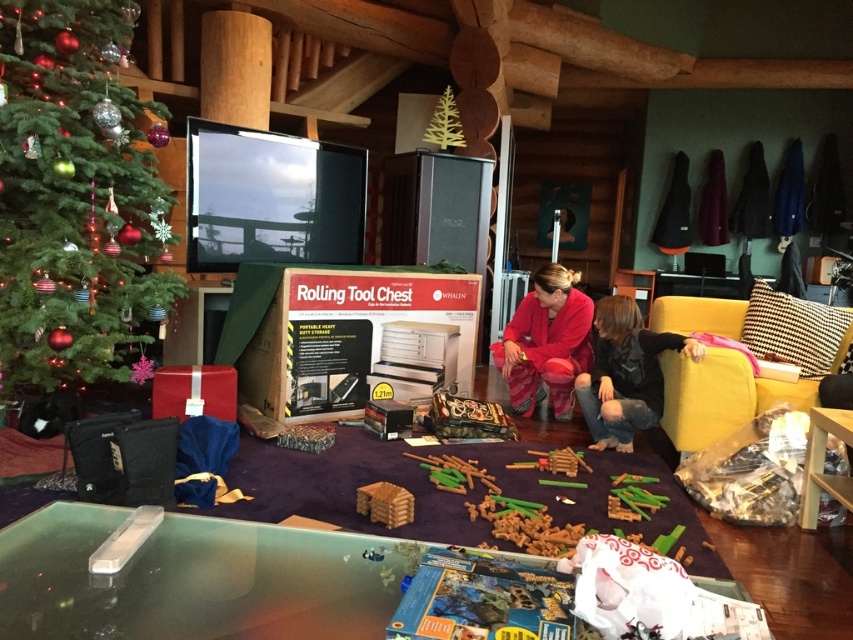
Who is taller, green matte christmas tree at upper left or green matte christmas tree at upper center?

green matte christmas tree at upper left is taller.

Does green matte christmas tree at upper left lie behind green matte christmas tree at upper center?

No, green matte christmas tree at upper left is closer to the viewer.

Locate an element on the screen. green matte christmas tree at upper left is located at coordinates (76, 196).

Does velvet red pants at center come in front of green matte christmas tree at upper center?

Yes, velvet red pants at center is closer to the viewer.

Where is `velvet red pants at center`? The height and width of the screenshot is (640, 853). velvet red pants at center is located at coordinates (546, 340).

Between point (561, 369) and point (450, 129), which one is positioned in front?

Point (561, 369) is more forward.

In order to click on velvet red pants at center in this screenshot , I will do `click(546, 340)`.

Who is more distant from viewer, (x=624, y=397) or (x=454, y=115)?

The point (x=454, y=115) is behind.

Does black cotton shirt at lower right have a lesser width compared to green matte christmas tree at upper center?

In fact, black cotton shirt at lower right might be wider than green matte christmas tree at upper center.

You are a GUI agent. You are given a task and a screenshot of the screen. Output one action in this format:
    pyautogui.click(x=<x>, y=<y>)
    Task: Click on the black cotton shirt at lower right
    This screenshot has width=853, height=640.
    Given the screenshot: What is the action you would take?
    pyautogui.click(x=625, y=372)